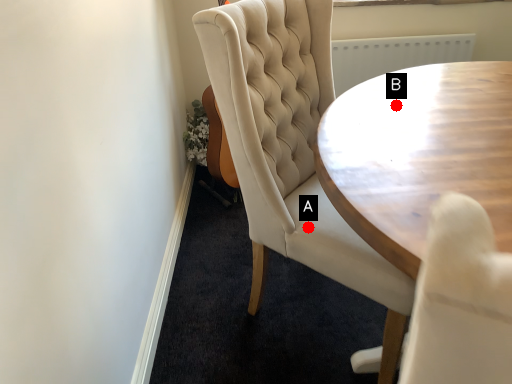
Question: Two points are circled on the image, labeled by A and B beside each circle. Among these points, which one is nearest to the camera?

Choices:
 (A) A is closer
 (B) B is closer

Answer: (B)